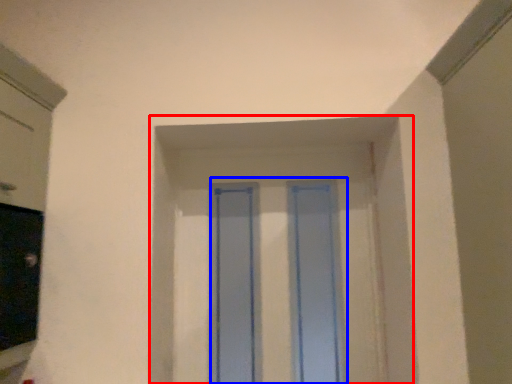
Question: Which point is closer to the camera, window frame (highlighted by a red box) or glass door (highlighted by a blue box)?

Choices:
 (A) window frame
 (B) glass door

Answer: (B)